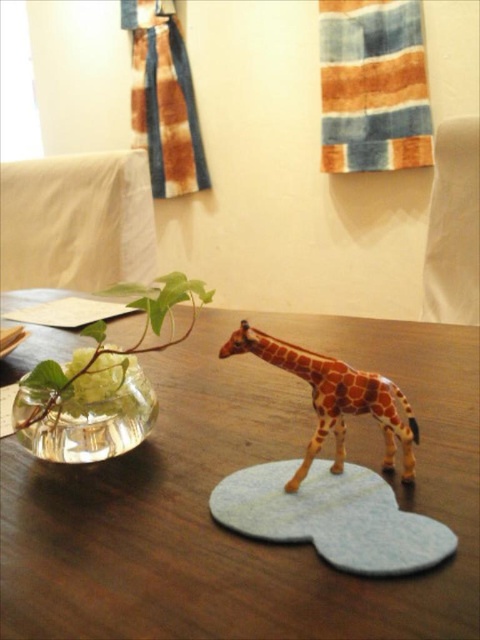
Is point (108, 513) farther from camera compared to point (321, 442)?

No, it is in front of (321, 442).

Image resolution: width=480 pixels, height=640 pixels. I want to click on brown wooden table at center, so click(217, 481).

Is transparent glass vase at left to the left of orange spotted plastic giraffe at center from the viewer's perspective?

Indeed, transparent glass vase at left is positioned on the left side of orange spotted plastic giraffe at center.

Is transparent glass vase at left taller than orange spotted plastic giraffe at center?

No.

The width and height of the screenshot is (480, 640). What are the coordinates of `transparent glass vase at left` in the screenshot? It's located at 96,416.

The height and width of the screenshot is (640, 480). What are the coordinates of `transparent glass vase at left` in the screenshot? It's located at point(96,416).

Measure the distance between point (355, 509) and camera.

Point (355, 509) is 11.11 inches away from camera.

Is light blue felt mat at center smaller than clear glass vase at left?

Correct, light blue felt mat at center occupies less space than clear glass vase at left.

Between point (415, 516) and point (35, 417), which one is positioned in front?

Point (415, 516)

Where is `light blue felt mat at center`? The height and width of the screenshot is (640, 480). light blue felt mat at center is located at coordinates (332, 516).